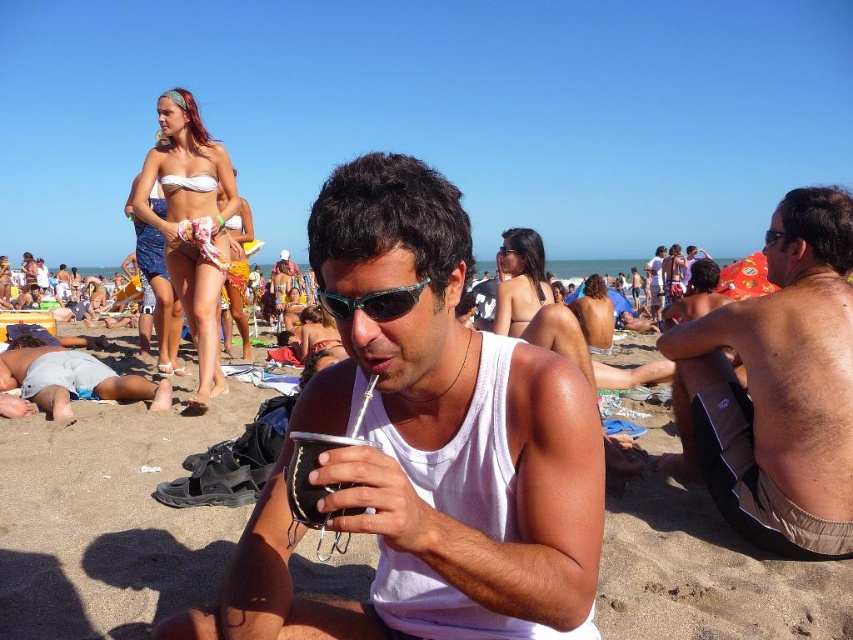
You are a photographer trying to capture the man in the white matte tank top at center and the sunglasses at center in a single shot. The camera has a maximum focus range of 12 inches. Can you fit both objects within the focus range?

The distance between the white matte tank top at center and sunglasses at center is 13.67 inches, which exceeds the camera focus range of 12 inches. Therefore, both objects cannot be captured in focus simultaneously.